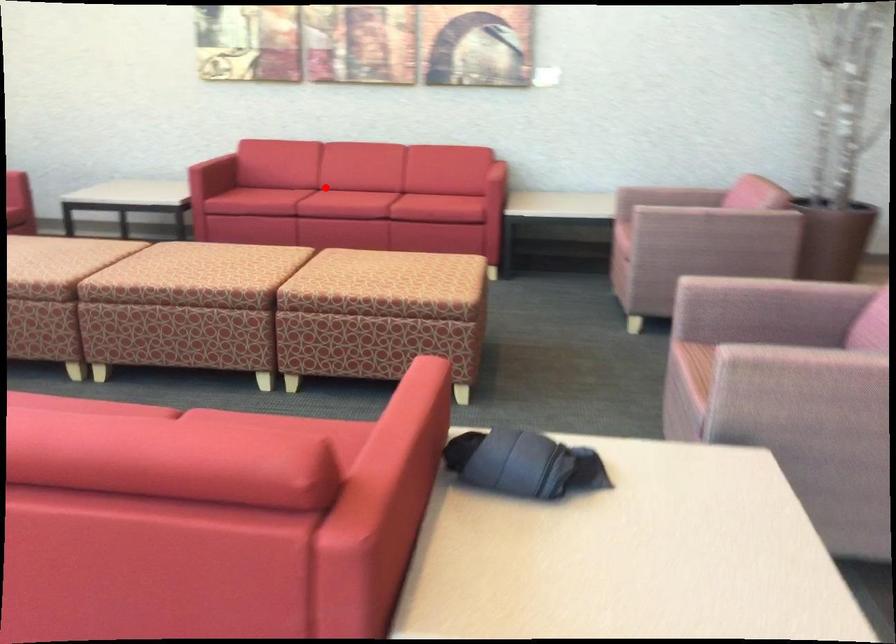
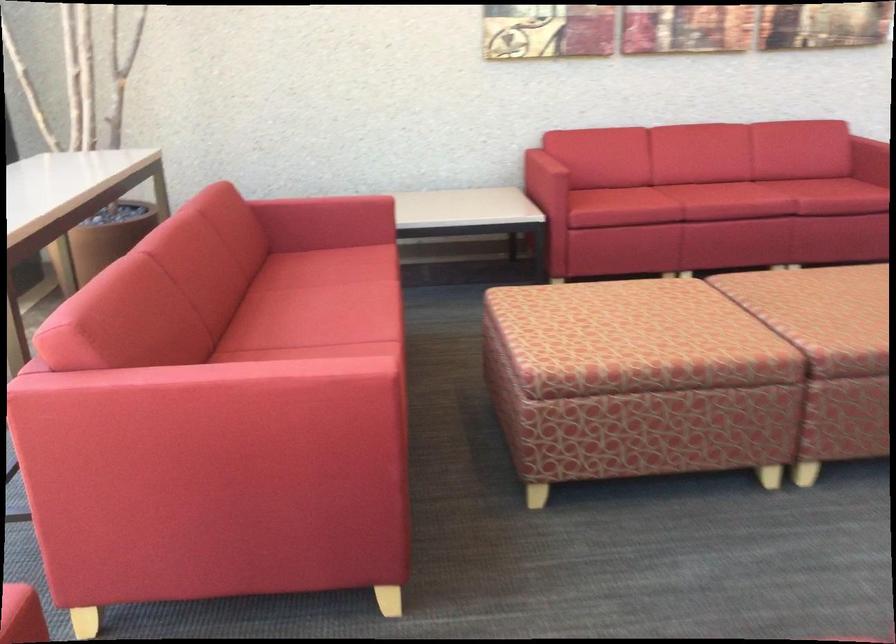
The point at the highlighted location is marked in the first image. Where is the corresponding point in the second image?

(725, 201)